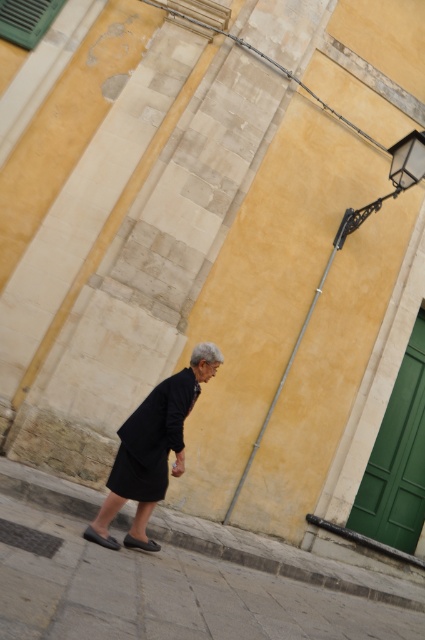
You are a shoe designer observing the street scene. You need to create a new sandal design that accommodates both the matte black sandal at lower left and the black leather sandal at lower center. Which sandal should you base your design on to ensure it fits the wider of the two?

The matte black sandal at lower left might be wider than black leather sandal at lower center, so you should base your design on the matte black sandal at lower left to ensure it accommodates the wider width.

You are a fashion designer analyzing the placement of clothing items in an urban setting. In the image provided, where is the matte black dress at center located in terms of coordinates?

The matte black dress at center is located at coordinates point (155, 442).